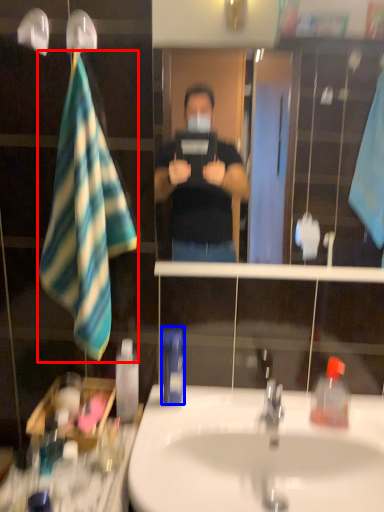
Question: Among these objects, which one is farthest to the camera, beach towel (highlighted by a red box) or mouthwash (highlighted by a blue box)?

Choices:
 (A) beach towel
 (B) mouthwash

Answer: (B)